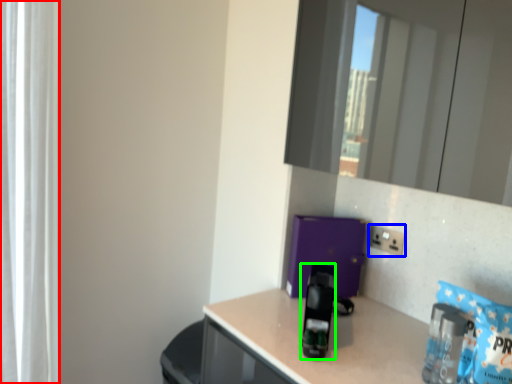
Question: Which is farther away from curtain (highlighted by a red box)? electric outlet (highlighted by a blue box) or appliance (highlighted by a green box)?

Choices:
 (A) electric outlet
 (B) appliance

Answer: (A)